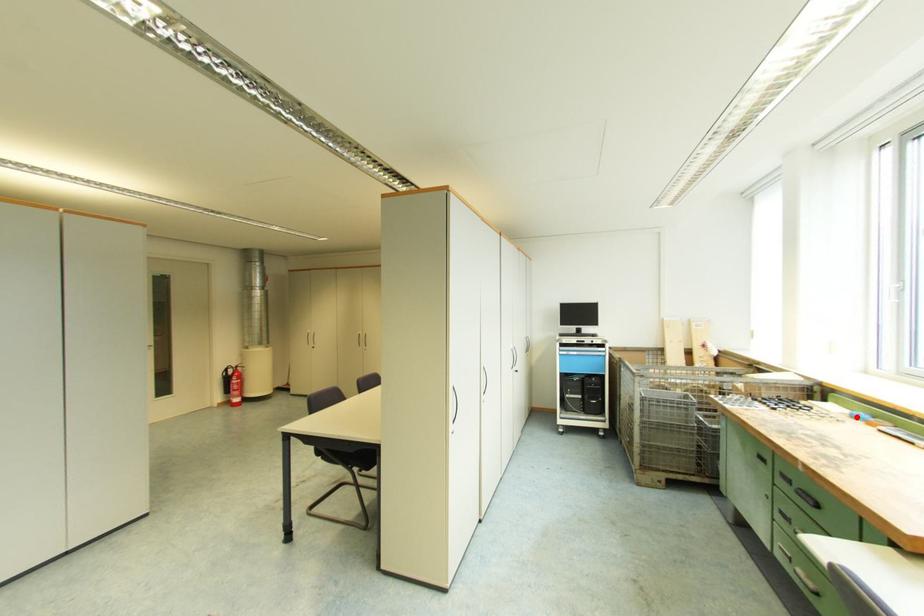
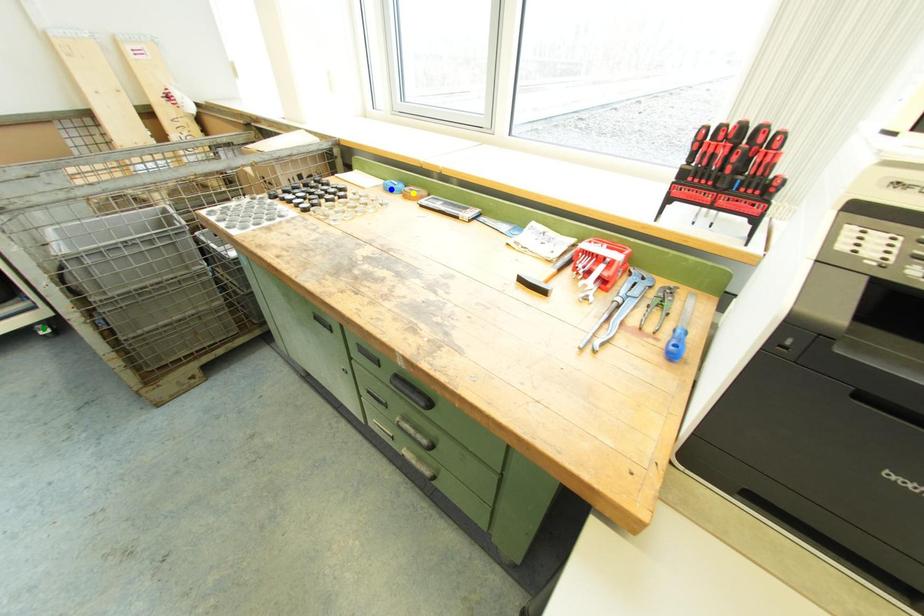
Question: I am providing you with two images of the same scene from different viewpoints. A red point is marked on the first image. You are given multiple points on the second image. Which point in image 2 represents the same 3d spot as the red point in image 1?

Choices:
 (A) blue point
 (B) yellow point
 (C) green point

Answer: (A)